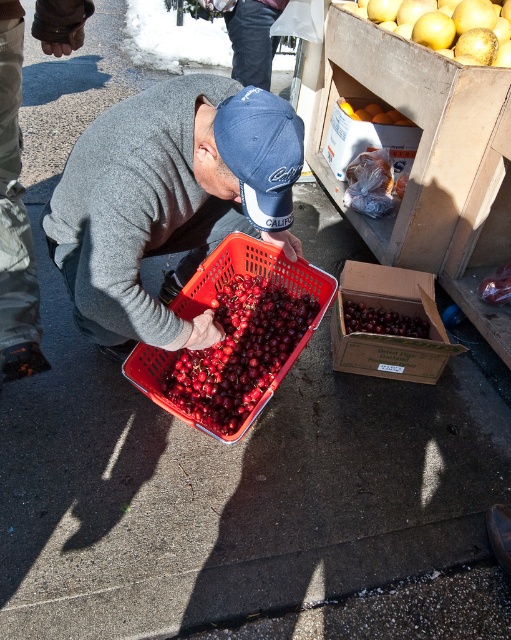
Does cardboard box of cherries at center have a smaller size compared to matte cardboard box at upper right?

Correct, cardboard box of cherries at center occupies less space than matte cardboard box at upper right.

Between cardboard box of cherries at center and matte cardboard box at upper right, which one appears on the right side from the viewer's perspective?

Positioned to the right is cardboard box of cherries at center.

Is point (421, 289) behind point (349, 134)?

No.

Find the location of `cardboard box of cherries at center`. cardboard box of cherries at center is located at coordinates (389, 333).

Does point (257, 179) come in front of point (379, 122)?

Yes, point (257, 179) is closer to viewer.

Can you confirm if navy blue fabric baseball cap at center is positioned to the right of smooth orange fruit at center?

In fact, navy blue fabric baseball cap at center is to the left of smooth orange fruit at center.

Between point (266, 204) and point (365, 120), which one is positioned behind?

The point (365, 120) is more distant.

At what (x,y) coordinates should I click in order to perform the action: click on navy blue fabric baseball cap at center. Please return your answer as a coordinate pair (x, y). Looking at the image, I should click on (261, 154).

Which is behind, point (256, 262) or point (410, 317)?

Positioned behind is point (410, 317).

Is red plastic basket at center below shiny dark purple grapes at center?

Indeed, red plastic basket at center is positioned under shiny dark purple grapes at center.

Does point (213, 262) come behind point (378, 321)?

No.

Locate an element on the screen. red plastic basket at center is located at coordinates (213, 298).